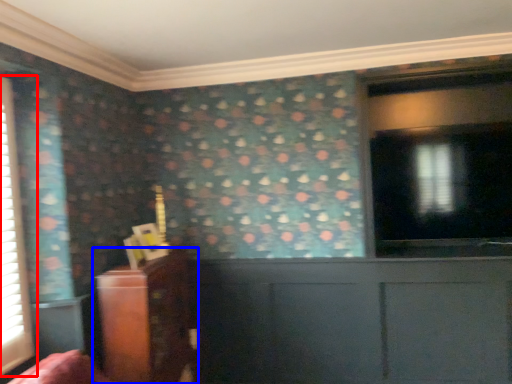
Question: Among these objects, which one is nearest to the camera, window (highlighted by a red box) or furniture (highlighted by a blue box)?

Choices:
 (A) window
 (B) furniture

Answer: (A)